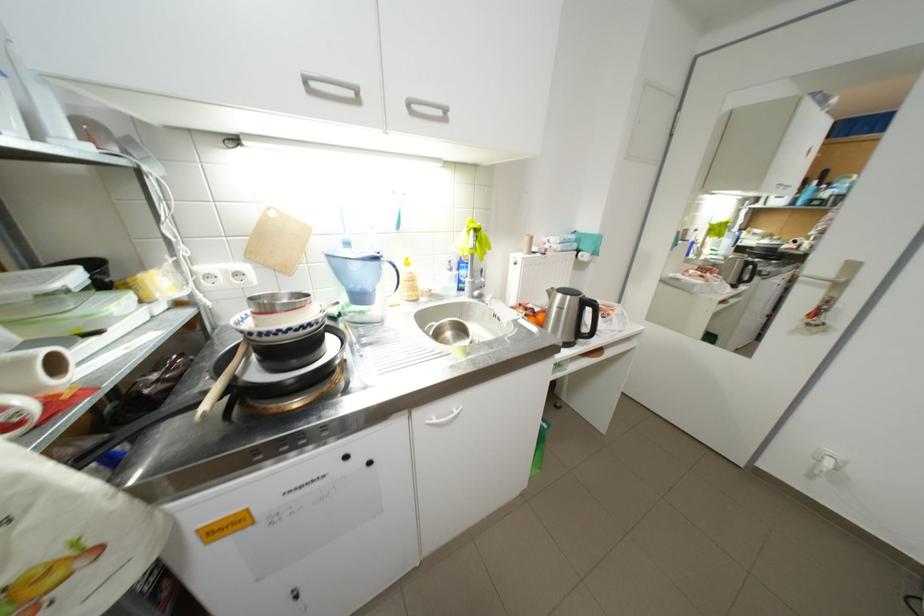
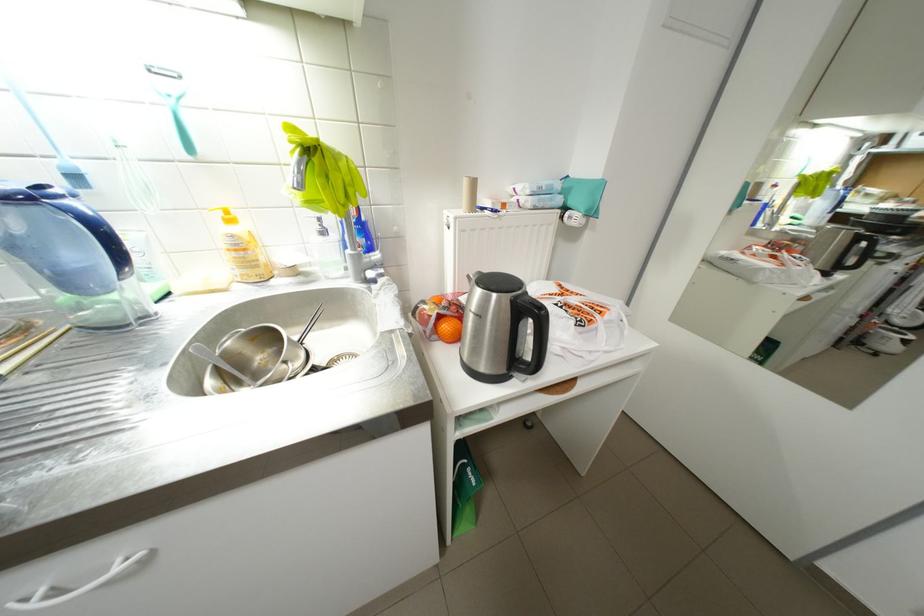
What movement of the cameraman would produce the second image?

The cameraman moved toward right, forward.